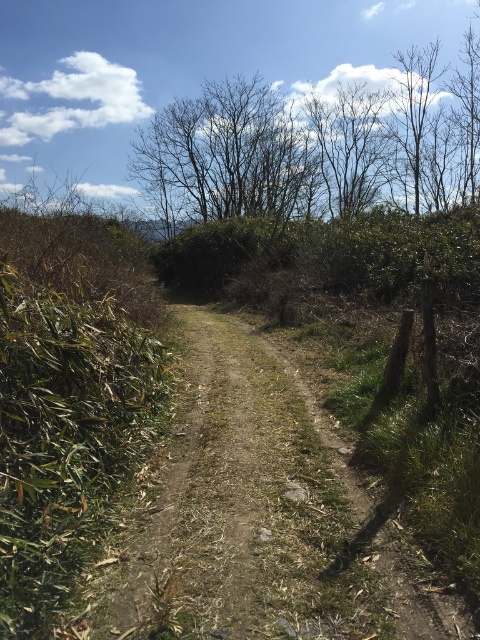
You are a hiker standing at the starting point of the dull brown dirt track at center. You notice the bare branches at upper center in the distance. Which object is closer to you?

The dull brown dirt track at center is closer to the viewer than the bare branches at upper center.

You are a hiker trying to follow the path. Where is the dull brown dirt track at center located in the image?

The dull brown dirt track at center is located at point (265, 516) in the image.

You are a hiker walking along the dull brown dirt track at center and looking up. Are the bare branches at upper center above or below you?

The dull brown dirt track at center is below the bare branches at upper center, so the bare branches at upper center are above you.